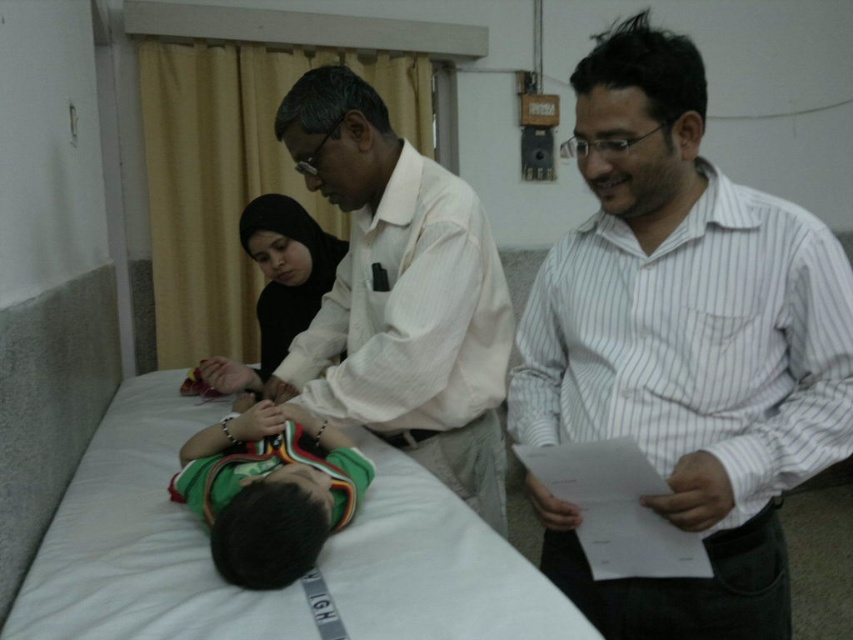
Question: Which object appears farthest from the camera in this image?

Choices:
 (A) green striped shirt at center
 (B) white striped shirt at center
 (C) white fabric bed at center

Answer: (A)

Question: Is green striped shirt at center smaller than matte black hijab at center?

Choices:
 (A) yes
 (B) no

Answer: (A)

Question: Which of these objects is positioned closest to the white fabric bed at center?

Choices:
 (A) white cotton shirt at center
 (B) matte black hijab at center

Answer: (A)

Question: Which point is farther from the camera taking this photo?

Choices:
 (A) (409, 522)
 (B) (383, 212)
 (C) (779, 257)

Answer: (B)

Question: Can you confirm if white fabric bed at center is bigger than white cotton shirt at center?

Choices:
 (A) no
 (B) yes

Answer: (B)

Question: Does white cotton shirt at center appear on the left side of green striped shirt at center?

Choices:
 (A) yes
 (B) no

Answer: (B)